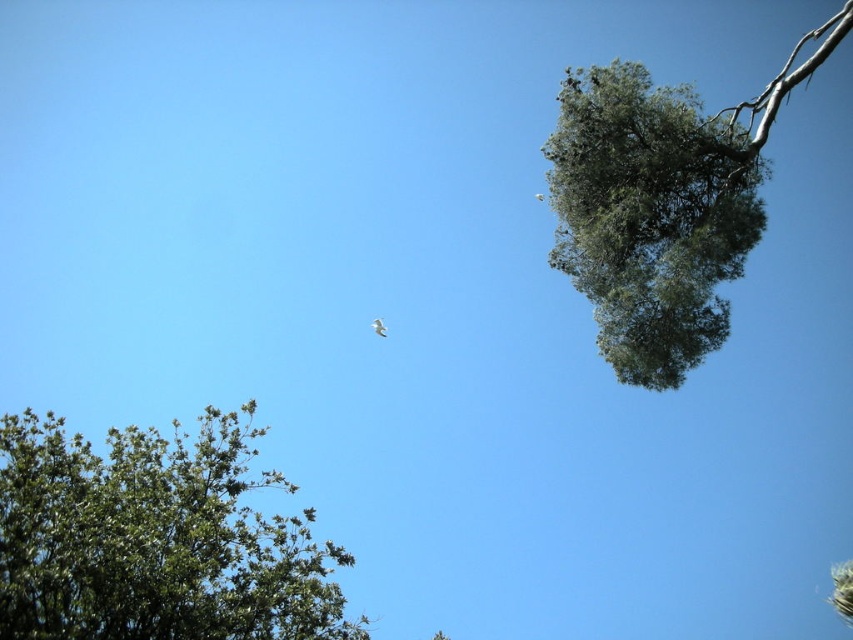
Question: Which point appears farthest from the camera in this image?

Choices:
 (A) (380, 323)
 (B) (558, 166)

Answer: (A)

Question: Estimate the real-world distances between objects in this image. Which object is farther from the white feathered bird at center?

Choices:
 (A) white feathered bird at upper center
 (B) green leafy olive tree at upper right

Answer: (B)

Question: Which is nearer to the green leafy olive tree at upper right?

Choices:
 (A) green leafy tree at lower left
 (B) white feathered bird at center

Answer: (A)

Question: Does green leafy olive tree at upper right appear on the left side of white feathered bird at upper center?

Choices:
 (A) yes
 (B) no

Answer: (B)

Question: Is the position of white feathered bird at center less distant than that of white feathered bird at upper center?

Choices:
 (A) yes
 (B) no

Answer: (A)

Question: Can you confirm if green leafy tree at lower left is positioned to the right of white feathered bird at center?

Choices:
 (A) yes
 (B) no

Answer: (B)